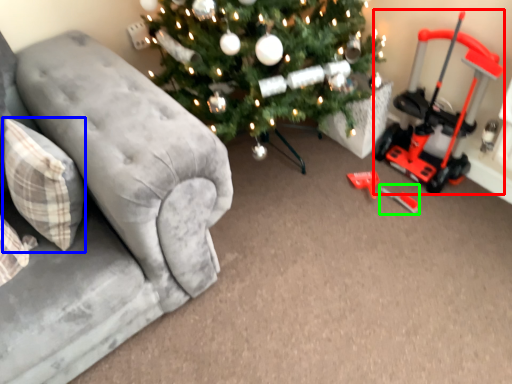
Question: Based on their relative distances, which object is farther from equipment (highlighted by a red box)? Choose from pillow (highlighted by a blue box) and toy (highlighted by a green box).

Choices:
 (A) pillow
 (B) toy

Answer: (A)